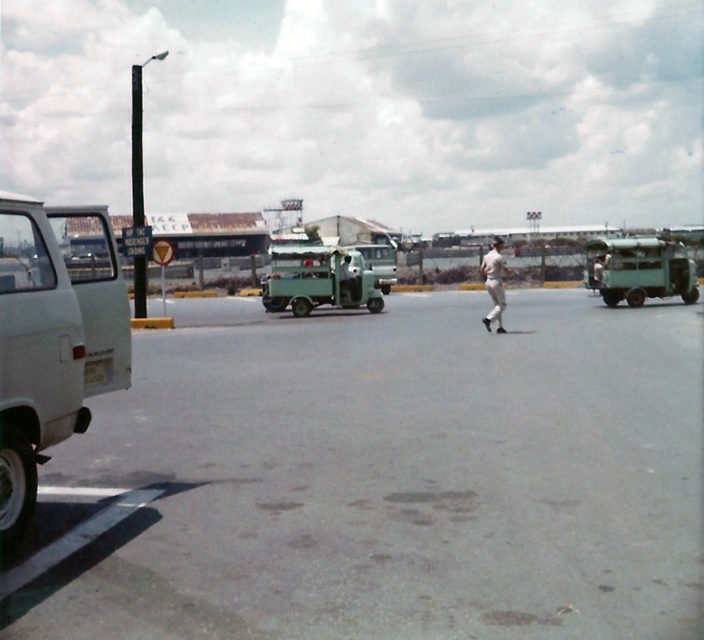
Question: From the image, what is the correct spatial relationship of white matte van at left in relation to green matte truck at right?

Choices:
 (A) right
 (B) left

Answer: (B)

Question: Which point is closer to the camera?

Choices:
 (A) white matte van at left
 (B) gray asphalt parking lot at center
 (C) green matte truck at center
 (D) green matte truck at right

Answer: (B)

Question: Which is nearer to the white fabric baseball cap at center?

Choices:
 (A) white matte van at left
 (B) green matte truck at center

Answer: (B)

Question: Can you confirm if green matte truck at center is bigger than green matte truck at right?

Choices:
 (A) no
 (B) yes

Answer: (B)

Question: Does white matte van at left have a lesser width compared to green matte truck at center?

Choices:
 (A) yes
 (B) no

Answer: (A)

Question: Which point is farther to the camera?

Choices:
 (A) gray asphalt parking lot at center
 (B) green matte truck at right

Answer: (B)